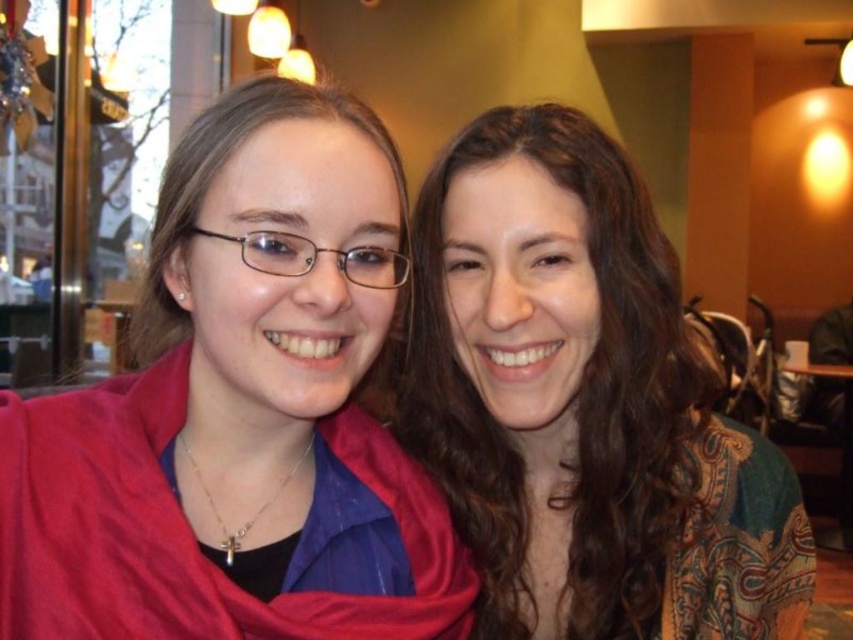
Can you confirm if matte red scarf at left is wider than matte brown hair at center?

No, matte red scarf at left is not wider than matte brown hair at center.

Is point (102, 394) positioned after point (523, 320)?

No, it is not.

The image size is (853, 640). I want to click on matte red scarf at left, so click(x=241, y=412).

Where is `matte red scarf at left`? Image resolution: width=853 pixels, height=640 pixels. matte red scarf at left is located at coordinates (241, 412).